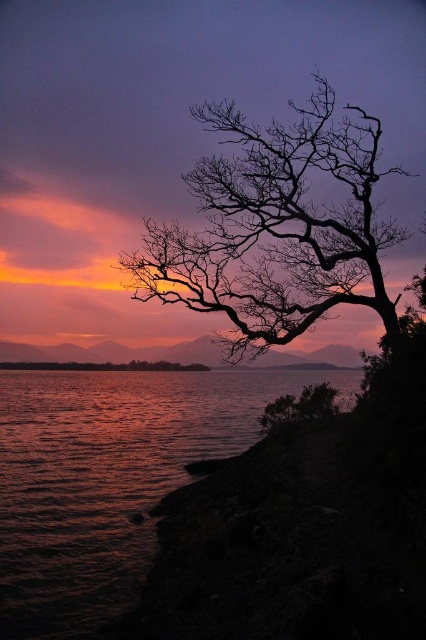
Question: Which of the following is the farthest from the observer?

Choices:
 (A) (137, 419)
 (B) (279, 333)

Answer: (A)

Question: Which object is farther from the camera taking this photo?

Choices:
 (A) shiny metallic water at lower left
 (B) silhouette bark tree at upper right

Answer: (B)

Question: Where is shiny metallic water at lower left located in relation to silhouette bark tree at upper right in the image?

Choices:
 (A) right
 (B) left

Answer: (B)

Question: Does shiny metallic water at lower left appear on the left side of silhouette bark tree at upper right?

Choices:
 (A) no
 (B) yes

Answer: (B)

Question: Is shiny metallic water at lower left further to camera compared to silhouette bark tree at upper right?

Choices:
 (A) yes
 (B) no

Answer: (B)